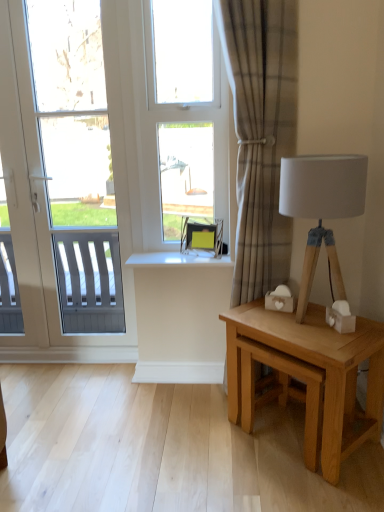
Question: Does white glossy window sill at center have a larger size compared to clear glass window at center?

Choices:
 (A) no
 (B) yes

Answer: (A)

Question: Considering the relative sizes of white glossy window sill at center and clear glass window at center in the image provided, is white glossy window sill at center taller than clear glass window at center?

Choices:
 (A) no
 (B) yes

Answer: (A)

Question: Can you confirm if white glossy window sill at center is wider than clear glass window at center?

Choices:
 (A) yes
 (B) no

Answer: (A)

Question: Is white glossy window sill at center at the right side of clear glass window at center?

Choices:
 (A) no
 (B) yes

Answer: (A)

Question: Does white glossy window sill at center have a lesser height compared to clear glass window at center?

Choices:
 (A) yes
 (B) no

Answer: (A)

Question: Is white glossy window sill at center oriented towards clear glass window at center?

Choices:
 (A) no
 (B) yes

Answer: (A)

Question: Is white plastic window at left to the left of white glossy window sill at center from the viewer's perspective?

Choices:
 (A) yes
 (B) no

Answer: (A)

Question: Is white plastic window at left wider than white glossy window sill at center?

Choices:
 (A) no
 (B) yes

Answer: (A)

Question: Is white plastic window at left not close to white glossy window sill at center?

Choices:
 (A) yes
 (B) no

Answer: (B)

Question: Considering the relative sizes of white plastic window at left and white glossy window sill at center in the image provided, is white plastic window at left taller than white glossy window sill at center?

Choices:
 (A) yes
 (B) no

Answer: (A)

Question: Is white plastic window at left shorter than white glossy window sill at center?

Choices:
 (A) yes
 (B) no

Answer: (B)

Question: Is white plastic window at left next to white glossy window sill at center and touching it?

Choices:
 (A) yes
 (B) no

Answer: (B)

Question: Can clear glass window at center be found inside light brown wooden table at right?

Choices:
 (A) yes
 (B) no

Answer: (B)